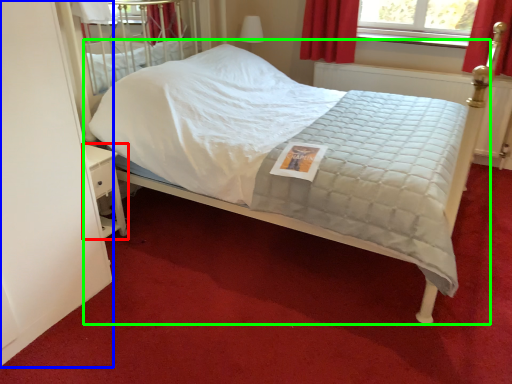
Question: Based on their relative distances, which object is nearer to nightstand (highlighted by a red box)? Choose from screen door (highlighted by a blue box) and bed (highlighted by a green box).

Choices:
 (A) screen door
 (B) bed

Answer: (A)